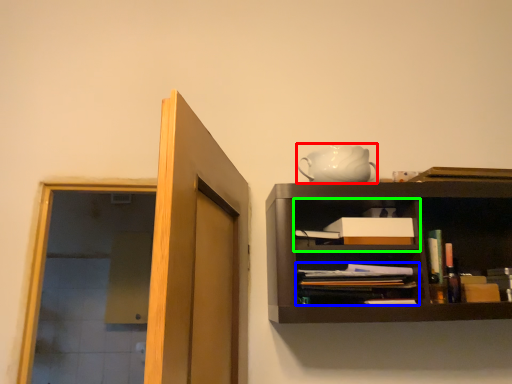
Question: Based on their relative distances, which object is farther from tea pot (highlighted by a red box)? Choose from book (highlighted by a blue box) and cabinet (highlighted by a green box).

Choices:
 (A) book
 (B) cabinet

Answer: (A)